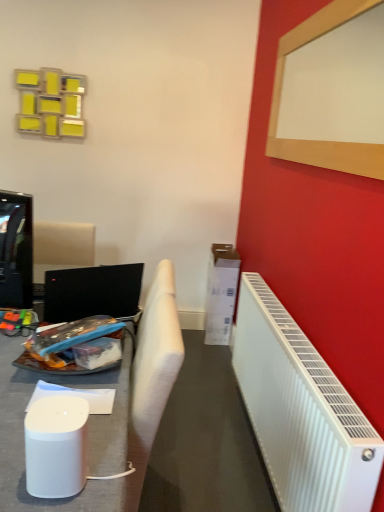
This screenshot has width=384, height=512. Describe the element at coordinates (16, 250) in the screenshot. I see `black glossy television at left` at that location.

Find the location of a particular element. black glossy television at left is located at coordinates (16, 250).

Relative to white fabric chair at left, is white plastic radiator at right in front or behind?

white plastic radiator at right is positioned closer to the viewer than white fabric chair at left.

Are white plastic radiator at right and white fabric chair at left making contact?

No, white plastic radiator at right is not with white fabric chair at left.

Does white plastic radiator at right turn towards white fabric chair at left?

Yes, white plastic radiator at right is turned towards white fabric chair at left.

Could you tell me if white fabric chair at left is turned towards black glossy television at left?

No, white fabric chair at left is not oriented towards black glossy television at left.

Considering the positions of point (107, 500) and point (1, 234), is point (107, 500) closer or farther from the camera than point (1, 234)?

Clearly, point (107, 500) is closer to the camera than point (1, 234).

Considering the positions of objects white fabric chair at left and black glossy television at left in the image provided, who is behind, white fabric chair at left or black glossy television at left?

Positioned behind is white fabric chair at left.

Is white fabric chair at left positioned far away from black glossy television at left?

white fabric chair at left is actually quite close to black glossy television at left.

Is black glossy television at left bigger than wooden frame at upper right?

No.

Is black glossy television at left not near wooden frame at upper right?

That's right, there is a large distance between black glossy television at left and wooden frame at upper right.

Where is `bulletin board on the right of black glossy television at left`? This screenshot has width=384, height=512. bulletin board on the right of black glossy television at left is located at coordinates (332, 90).

How distant is wooden frame at upper right from black glossy television at left?

wooden frame at upper right and black glossy television at left are 2.24 meters apart.

The width and height of the screenshot is (384, 512). I want to click on television below the wooden frame at upper right (from a real-world perspective), so click(16, 250).

From the image's perspective, is wooden frame at upper right below black glossy television at left?

Actually, wooden frame at upper right appears above black glossy television at left in the image.

Consider the image. Considering the sizes of objects wooden frame at upper right and black glossy television at left in the image provided, who is taller, wooden frame at upper right or black glossy television at left?

Standing taller between the two is wooden frame at upper right.

Choose the correct answer: Is black glossy television at left inside black glossy laptop at left or outside it?

black glossy television at left exists outside the volume of black glossy laptop at left.

Is black glossy television at left shorter than black glossy laptop at left?

No, black glossy television at left is not shorter than black glossy laptop at left.

Is black glossy television at left far away from black glossy laptop at left?

No, black glossy television at left is not far from black glossy laptop at left.

Who is smaller, black glossy television at left or black glossy laptop at left?

Smaller between the two is black glossy television at left.

From the image's perspective, which one is positioned higher, white fabric chair at left or white plastic radiator at right?

white fabric chair at left is shown above in the image.

Is point (66, 377) closer to viewer compared to point (257, 351)?

Yes, it is.

From a real-world perspective, who is located lower, white fabric chair at left or white plastic radiator at right?

From a 3D spatial view, white plastic radiator at right is below.

Is black glossy laptop at left touching black glossy television at left?

black glossy laptop at left is not next to black glossy television at left, and they're not touching.

Can you confirm if black glossy laptop at left is shorter than black glossy television at left?

Indeed, black glossy laptop at left has a lesser height compared to black glossy television at left.

From a real-world perspective, is black glossy laptop at left positioned above or below black glossy television at left?

From a real-world perspective, black glossy laptop at left is physically below black glossy television at left.

Considering the relative sizes of black glossy laptop at left and black glossy television at left in the image provided, is black glossy laptop at left smaller than black glossy television at left?

No.

At what (x,y) coordinates should I click in order to perform the action: click on radiator that is in front of the white fabric chair at left. Please return your answer as a coordinate pair (x, y). This screenshot has height=512, width=384. Looking at the image, I should click on [301, 411].

Locate an element on the screen. The width and height of the screenshot is (384, 512). furniture below the black glossy television at left (from the image's perspective) is located at coordinates (101, 415).

From the image, which object appears to be farther from white fabric chair at left, black glossy television at left or white plastic radiator at right?

The object further to white fabric chair at left is white plastic radiator at right.

When comparing their distances from wooden frame at upper right, does white plastic radiator at right or black glossy television at left seem further?

Among the two, black glossy television at left is located further to wooden frame at upper right.

Based on their spatial positions, is white fabric chair at left or black glossy laptop at left further from white plastic radiator at right?

black glossy laptop at left is further to white plastic radiator at right.

Which object lies nearer to the anchor point black glossy laptop at left, white plastic radiator at right or black glossy television at left?

black glossy television at left is closer to black glossy laptop at left.

Estimate the real-world distances between objects in this image. Which object is further from black glossy laptop at left, white plastic radiator at right or white fabric chair at left?

white plastic radiator at right.

Considering their positions, is wooden frame at upper right positioned further to black glossy television at left than black glossy laptop at left?

The object further to black glossy television at left is wooden frame at upper right.

Based on their spatial positions, is white fabric chair at left or white plastic radiator at right closer to black glossy television at left?

white fabric chair at left is positioned closer to the anchor black glossy television at left.

From the image, which object appears to be nearer to white fabric chair at left, wooden frame at upper right or black glossy television at left?

The object closer to white fabric chair at left is black glossy television at left.

Where is `laptop between black glossy television at left and white plastic radiator at right`? The height and width of the screenshot is (512, 384). laptop between black glossy television at left and white plastic radiator at right is located at coordinates 93,292.

At what (x,y) coordinates should I click in order to perform the action: click on furniture between black glossy television at left and wooden frame at upper right in the horizontal direction. Please return your answer as a coordinate pair (x, y). Looking at the image, I should click on (101, 415).

Locate an element on the screen. laptop between wooden frame at upper right and white fabric chair at left in the vertical direction is located at coordinates (93, 292).

You are a GUI agent. You are given a task and a screenshot of the screen. Output one action in this format:
    pyautogui.click(x=<x>, y=<y>)
    Task: Click on the furniture situated between black glossy television at left and white plastic radiator at right from left to right
    
    Given the screenshot: What is the action you would take?
    pyautogui.click(x=101, y=415)